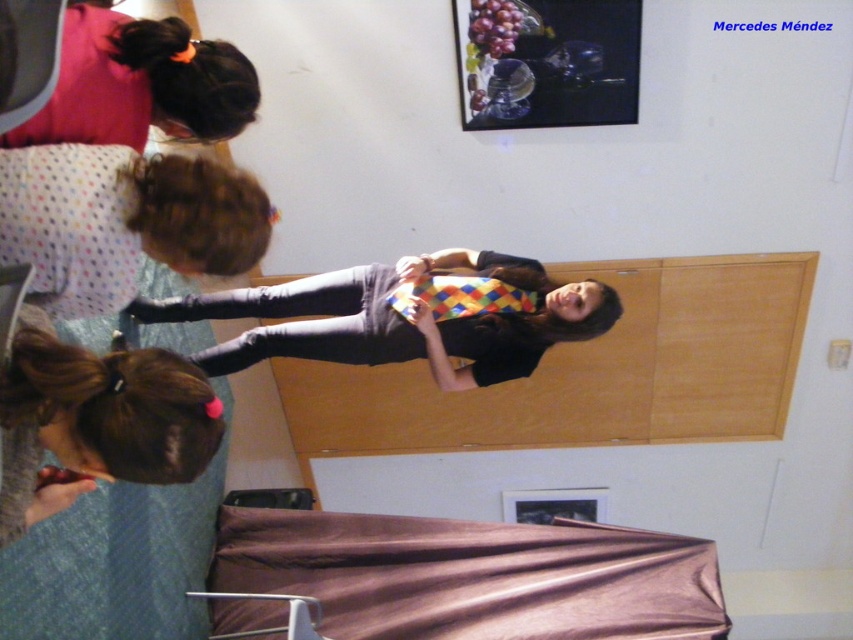
You are organizing a fashion show and need to decide which fabric to use for a large banner. The banner requires a fabric that is wider than the other. Based on the image, which fabric between the multicolored fabric tie at center and the polka dot fabric at upper left should you choose?

The multicolored fabric tie at center should be chosen because its width is larger than the polka dot fabric at upper left.

You are planning to place a new decorative item on the brown satin bed at lower center. Considering the size of the bed and the brown hair at upper left, which object has a greater width to accommodate the item?

The brown satin bed at lower center has a greater width than the brown hair at upper left, so it can accommodate the decorative item better.